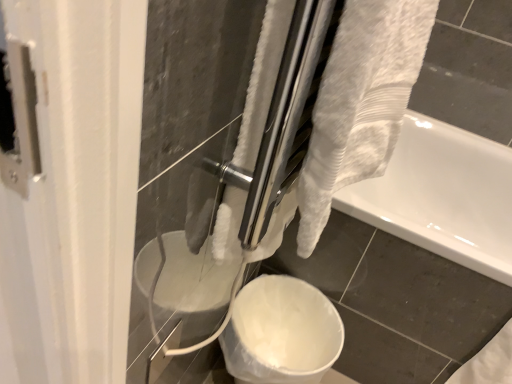
Find the location of `white plastic toilet bowl at lower center`. white plastic toilet bowl at lower center is located at coordinates (281, 332).

This screenshot has width=512, height=384. What do you see at coordinates (281, 332) in the screenshot?
I see `white plastic toilet bowl at lower center` at bounding box center [281, 332].

In order to click on white plastic toilet bowl at lower center in this screenshot , I will do `click(281, 332)`.